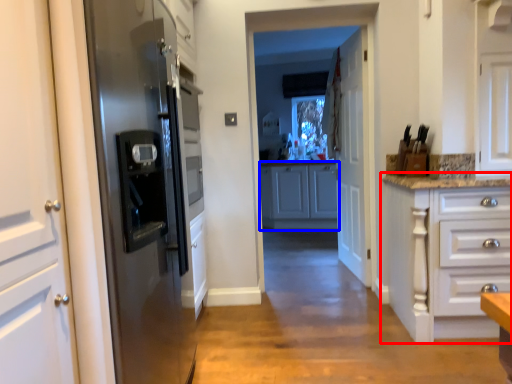
Question: Which of the following is the closest to the observer, cabinetry (highlighted by a red box) or cabinetry (highlighted by a blue box)?

Choices:
 (A) cabinetry
 (B) cabinetry

Answer: (A)